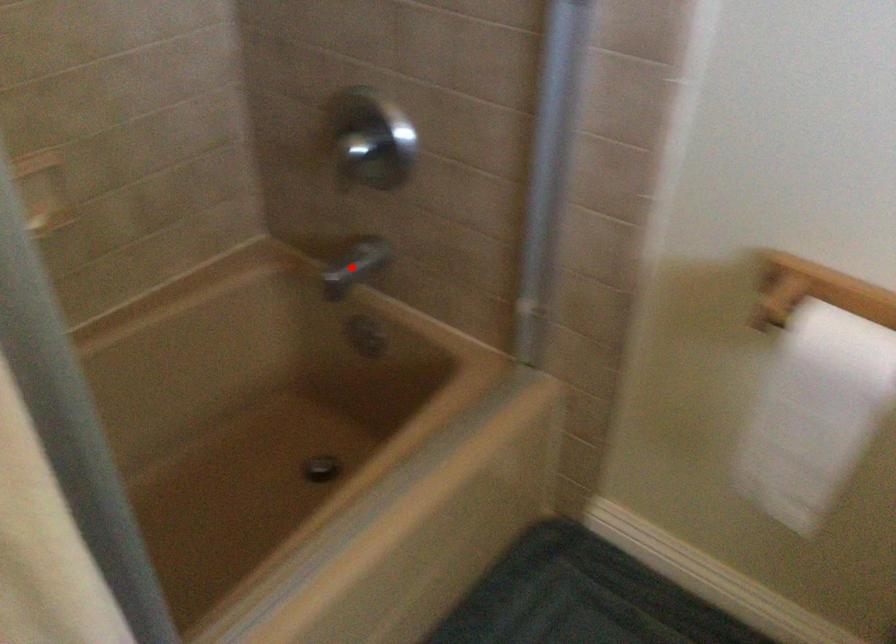
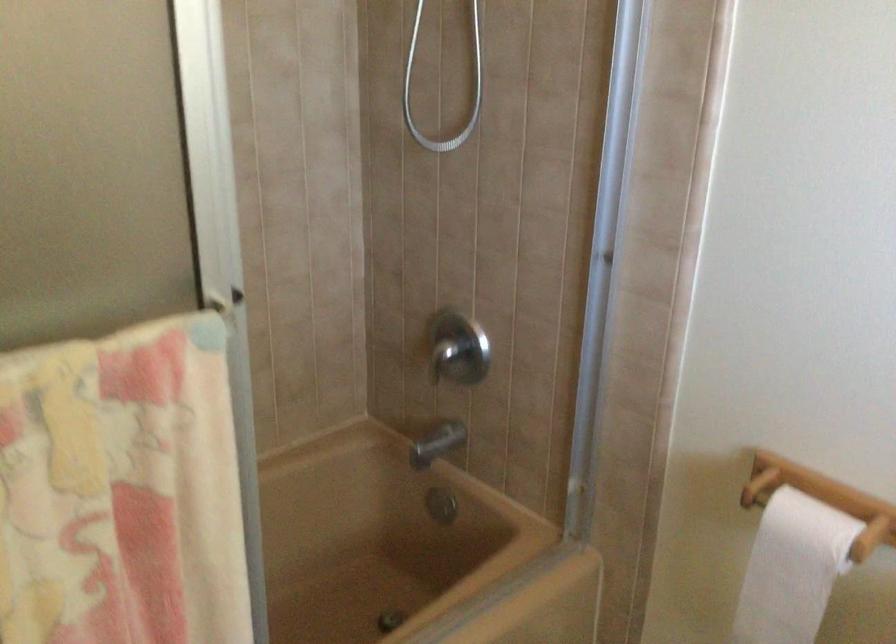
Locate, in the second image, the point that corresponds to the highlighted location in the first image.

(436, 444)